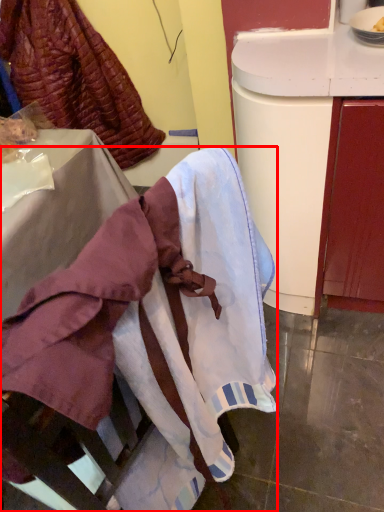
Question: Where is furniture (annotated by the red box) located in relation to leftover in the image?

Choices:
 (A) right
 (B) left

Answer: (A)